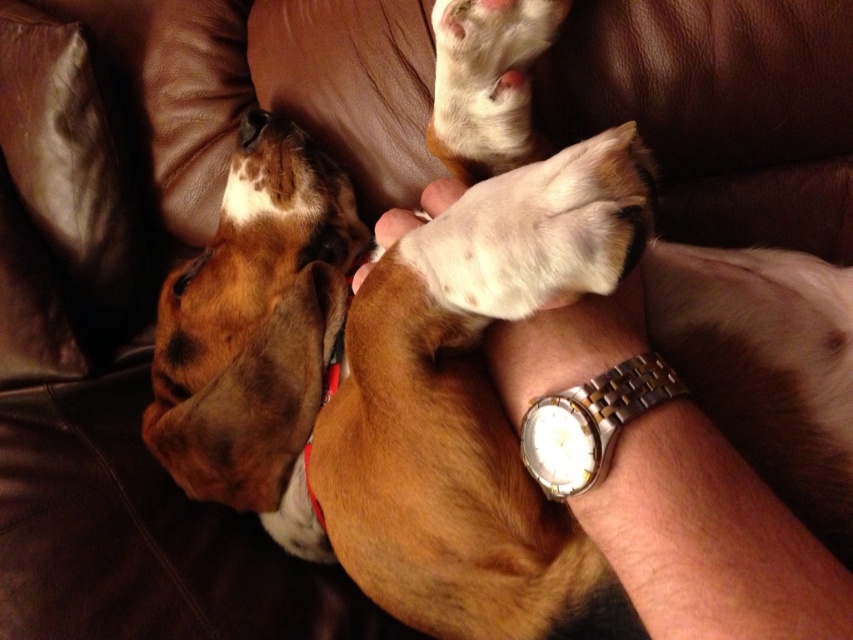
What object is located at the coordinates point (590,422) in the image?

The point (590,422) marks the gold steel watch at center.

You are taking a photo of the dog and want to focus on two specific points in the image. The first point is at coordinates point (577, 444), and the second point is at point (329, 360). Which point should you focus on first if you want to ensure the closest point is in sharp focus?

Point (577, 444) is closer to the camera than point (329, 360), so you should focus on point (577, 444) first to ensure the closest point is in sharp focus.